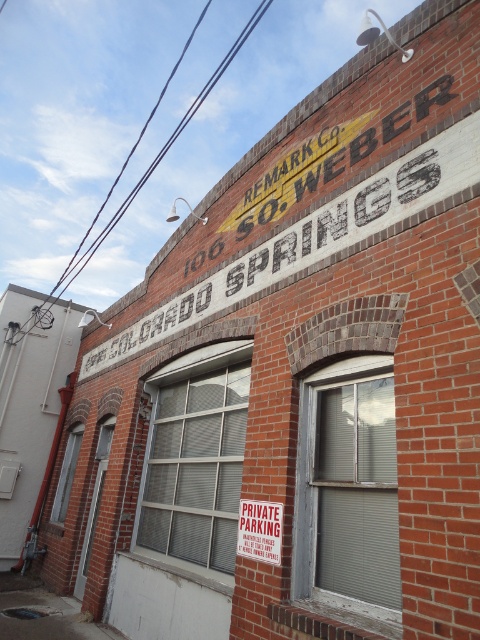
Does point (223, 273) come behind point (70, 451)?

No, it is in front of (70, 451).

Is point (192, 305) in front of point (76, 435)?

Yes, point (192, 305) is in front of point (76, 435).

Does point (394, 202) come in front of point (75, 464)?

That is True.

The width and height of the screenshot is (480, 640). I want to click on white painted brick sign at upper center, so click(x=291, y=250).

Between gray wooden window at center and clear glass window at lower left, which one is positioned lower?

Positioned lower is clear glass window at lower left.

Does point (350, 481) come farther from viewer compared to point (73, 442)?

No, (350, 481) is closer to viewer.

Is point (332, 580) less distant than point (56, 502)?

Yes, it is in front of point (56, 502).

In order to click on gray wooden window at center in this screenshot , I will do `click(348, 484)`.

Can you confirm if clear glass window at center is taller than white painted text at upper center?

Yes.

Which is above, clear glass window at center or white painted text at upper center?

Positioned higher is white painted text at upper center.

Is point (235, 444) farther from camera compared to point (298, 163)?

Yes, point (235, 444) is farther from viewer.

This screenshot has height=640, width=480. In order to click on clear glass window at center in this screenshot , I will do `click(196, 456)`.